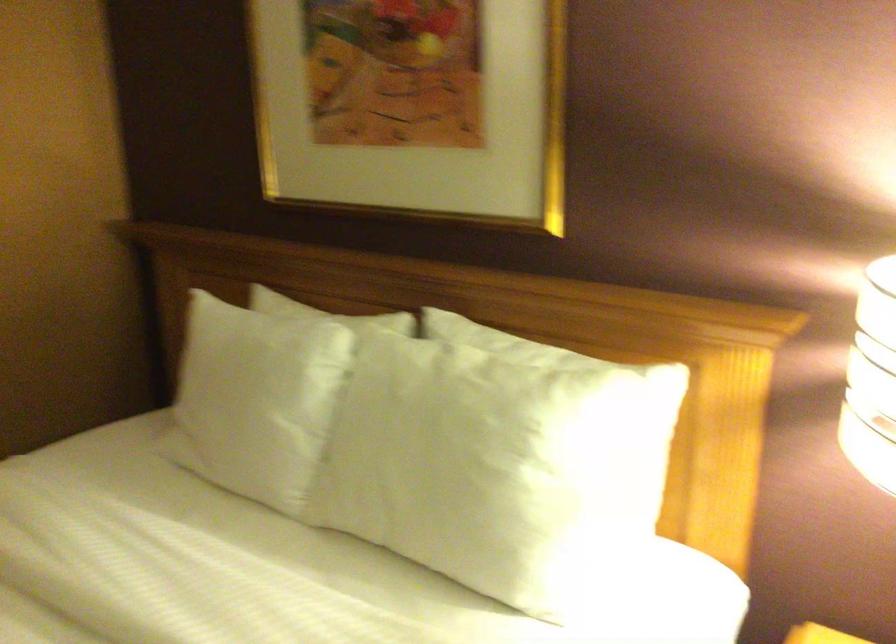
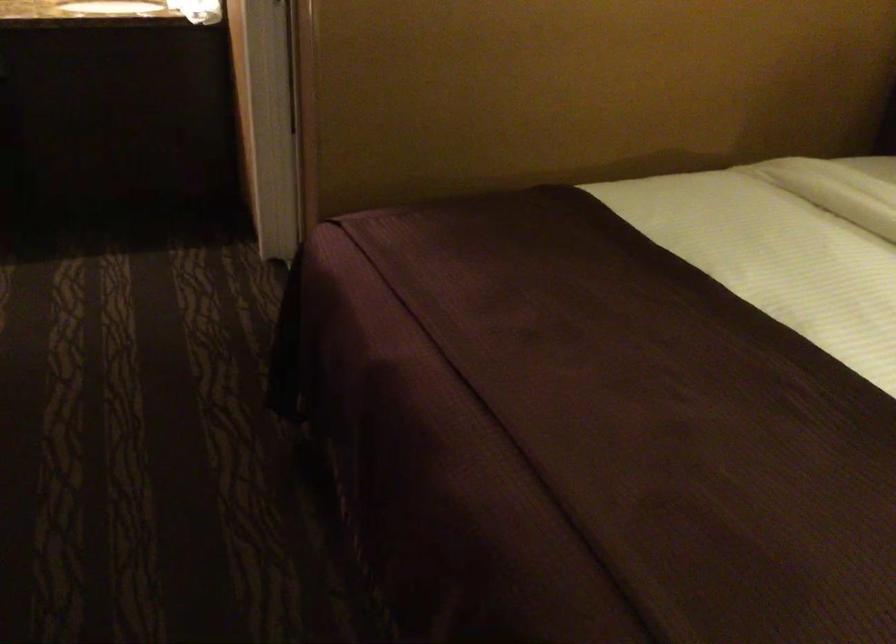
From the picture: The first image is from the beginning of the video and the second image is from the end. How did the camera likely rotate when shooting the video?

The rotation direction of the camera is left-down.